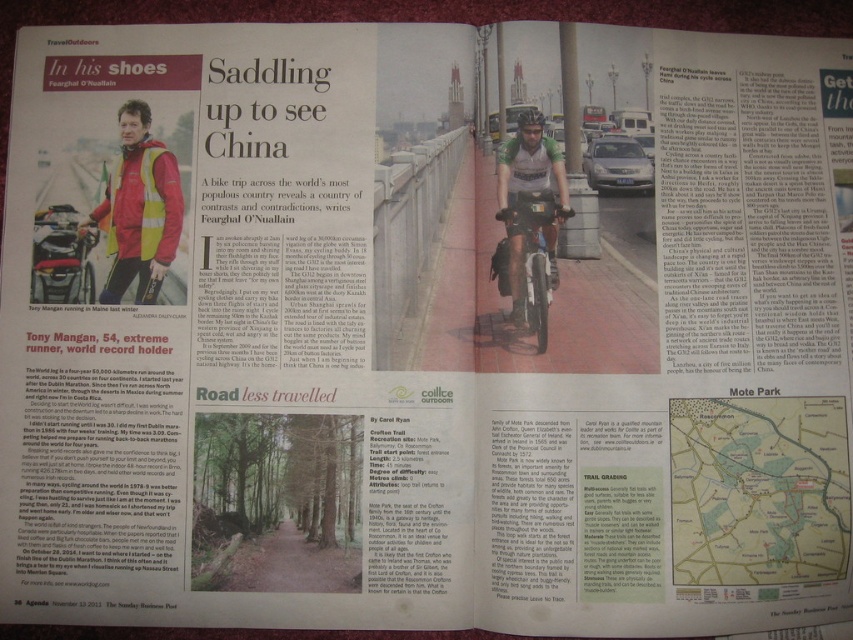
Can you confirm if paper map at lower right is positioned to the left of shiny metallic bicycle at center?

In fact, paper map at lower right is to the right of shiny metallic bicycle at center.

Measure the distance between paper map at lower right and shiny metallic bicycle at center.

paper map at lower right and shiny metallic bicycle at center are 6.30 inches apart.

Between point (729, 454) and point (535, 241), which one is positioned behind?

The point (535, 241) is behind.

Identify the location of paper map at lower right. The image size is (853, 640). (758, 490).